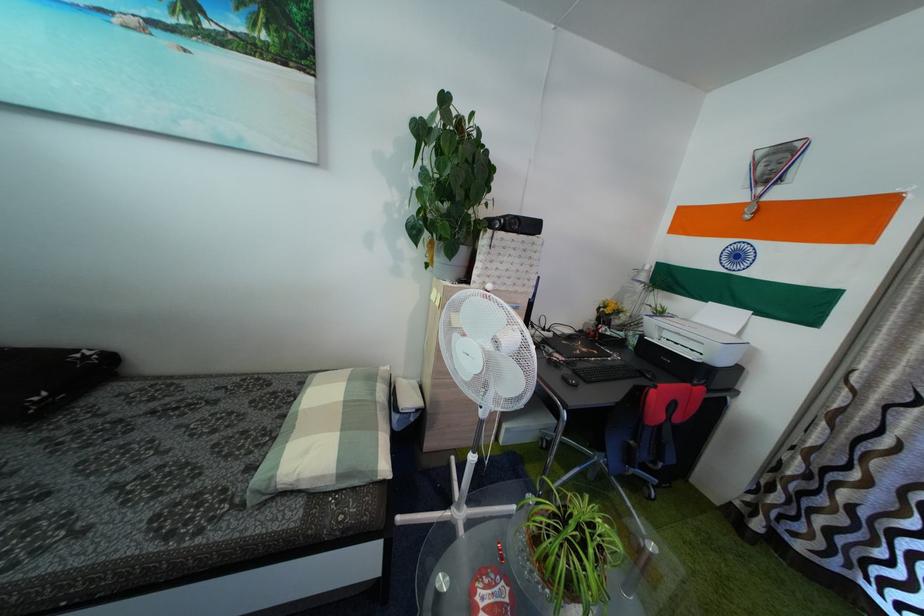
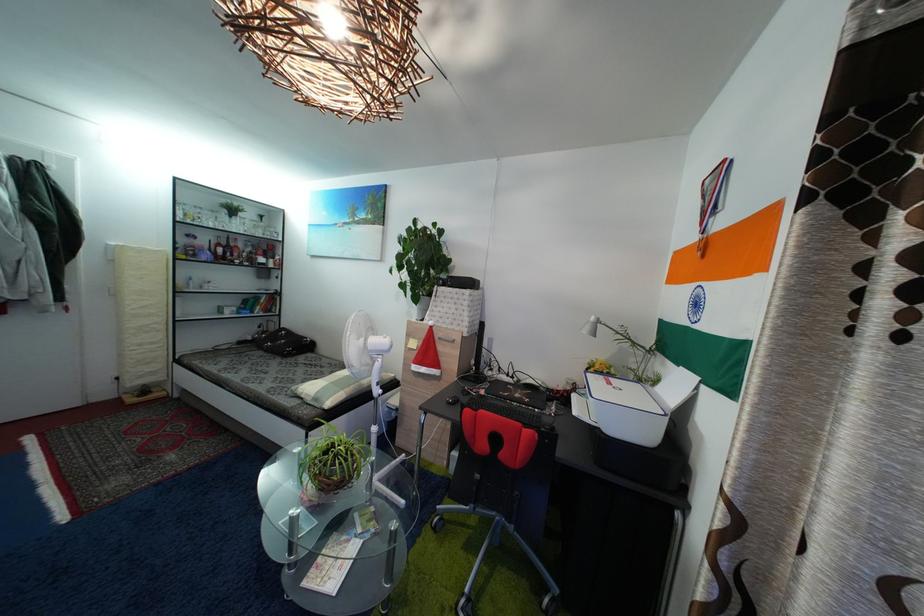
The point at (338, 492) is marked in the first image. Where is the corresponding point in the second image?

(318, 407)